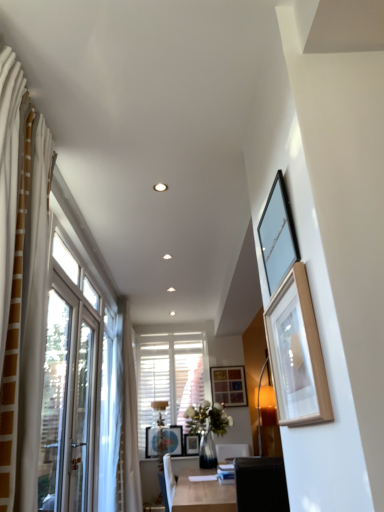
Question: Is wooden picture frame at center, which appears as the 4th picture frame when viewed from the right, next to light wood table at center and touching it?

Choices:
 (A) no
 (B) yes

Answer: (A)

Question: Is wooden picture frame at center, acting as the fifth picture frame starting from the top, outside of light wood table at center?

Choices:
 (A) no
 (B) yes

Answer: (B)

Question: Is wooden picture frame at center, the 2th picture frame viewed from the back, closer to camera compared to light wood table at center?

Choices:
 (A) no
 (B) yes

Answer: (A)

Question: Considering the relative sizes of wooden picture frame at center, the second picture frame viewed from the left, and light wood table at center in the image provided, is wooden picture frame at center, the second picture frame viewed from the left, smaller than light wood table at center?

Choices:
 (A) yes
 (B) no

Answer: (A)

Question: Is wooden picture frame at center, the 2th picture frame viewed from the back, at the right side of light wood table at center?

Choices:
 (A) no
 (B) yes

Answer: (B)

Question: In the image, is light wood table at center positioned in front of or behind wooden picture frame at center, the fifth picture frame in the front-to-back sequence?

Choices:
 (A) front
 (B) behind

Answer: (A)

Question: Is light wood table at center taller or shorter than wooden picture frame at center, which is the 5th picture frame in left-to-right order?

Choices:
 (A) short
 (B) tall

Answer: (A)

Question: Is light wood table at center bigger or smaller than wooden picture frame at center, which is the 5th picture frame in left-to-right order?

Choices:
 (A) small
 (B) big

Answer: (B)

Question: Would you say light wood table at center is to the left or to the right of wooden picture frame at center, which is the 5th picture frame in left-to-right order, in the picture?

Choices:
 (A) left
 (B) right

Answer: (A)

Question: Is matte black picture frame at upper right, the 5th picture frame ordered from the bottom, inside the boundaries of wooden picture frame at center, which ranks as the 5th picture frame in right-to-left order, or outside?

Choices:
 (A) outside
 (B) inside

Answer: (A)

Question: In terms of width, does matte black picture frame at upper right, the 5th picture frame ordered from the bottom, look wider or thinner when compared to wooden picture frame at center, which ranks as the 5th picture frame in right-to-left order?

Choices:
 (A) thin
 (B) wide

Answer: (A)

Question: Relative to wooden picture frame at center, the 2th picture frame positioned from the bottom, is matte black picture frame at upper right, the 1th picture frame from the top, in front or behind?

Choices:
 (A) front
 (B) behind

Answer: (A)

Question: From a real-world perspective, is matte black picture frame at upper right, the 3th picture frame in the right-to-left sequence, above or below wooden picture frame at center, which ranks as the 5th picture frame in right-to-left order?

Choices:
 (A) below
 (B) above

Answer: (B)

Question: Is point (193, 446) positioned closer to the camera than point (306, 378)?

Choices:
 (A) farther
 (B) closer

Answer: (A)

Question: Relative to wooden picture frame at upper right, which is the 1th picture frame from front to back, is wooden picture frame at center, the 2th picture frame viewed from the back, in front or behind?

Choices:
 (A) behind
 (B) front

Answer: (A)